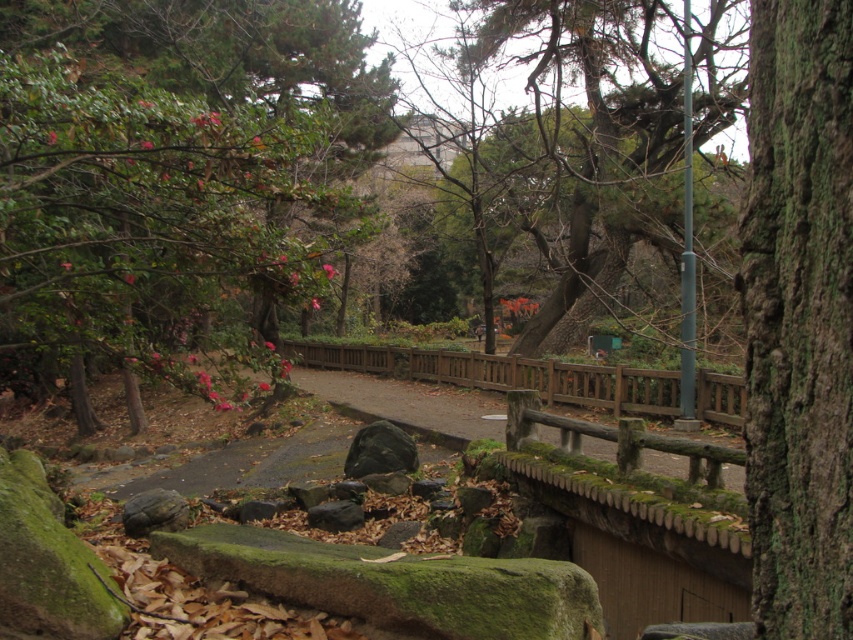
Can you confirm if green leafy tree at upper left is bigger than green textured tree at upper center?

Indeed, green leafy tree at upper left has a larger size compared to green textured tree at upper center.

Which is above, green leafy tree at upper left or green textured tree at upper center?

green textured tree at upper center

Is point (280, 244) more distant than point (459, 8)?

No.

The height and width of the screenshot is (640, 853). Identify the location of green leafy tree at upper left. (178, 168).

Which is more to the left, green textured tree at upper center or dark gray stone at center?

Positioned to the left is dark gray stone at center.

Which is below, green textured tree at upper center or dark gray stone at center?

Positioned lower is dark gray stone at center.

Describe the element at coordinates (572, 141) in the screenshot. I see `green textured tree at upper center` at that location.

Where is `green textured tree at upper center`? The width and height of the screenshot is (853, 640). green textured tree at upper center is located at coordinates (572, 141).

Can you confirm if green leafy tree at upper left is positioned above dark gray stone at center?

Yes, green leafy tree at upper left is above dark gray stone at center.

Measure the distance between green leafy tree at upper left and camera.

4.87 meters

Which is in front, point (131, 131) or point (352, 470)?

Point (131, 131) is in front.

I want to click on green leafy tree at upper left, so click(178, 168).